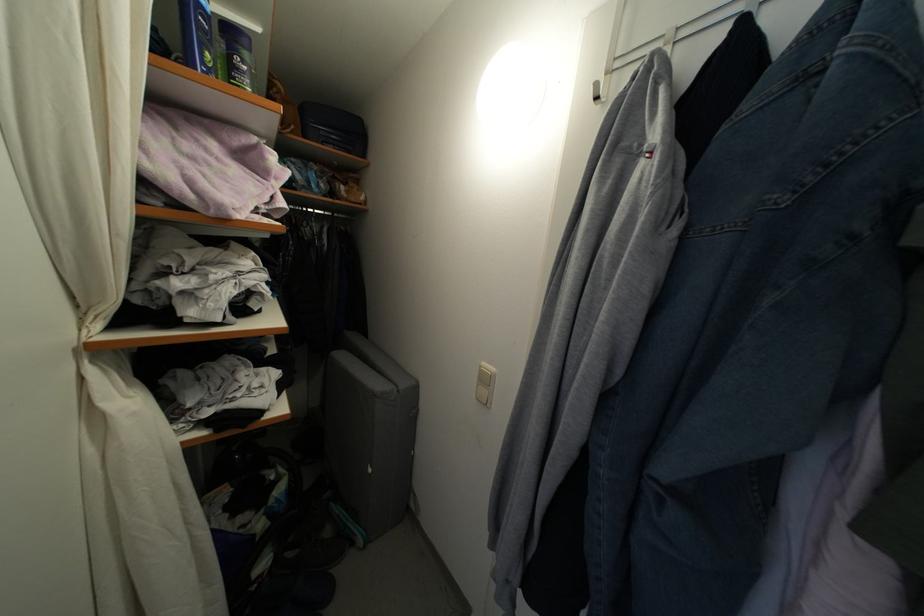
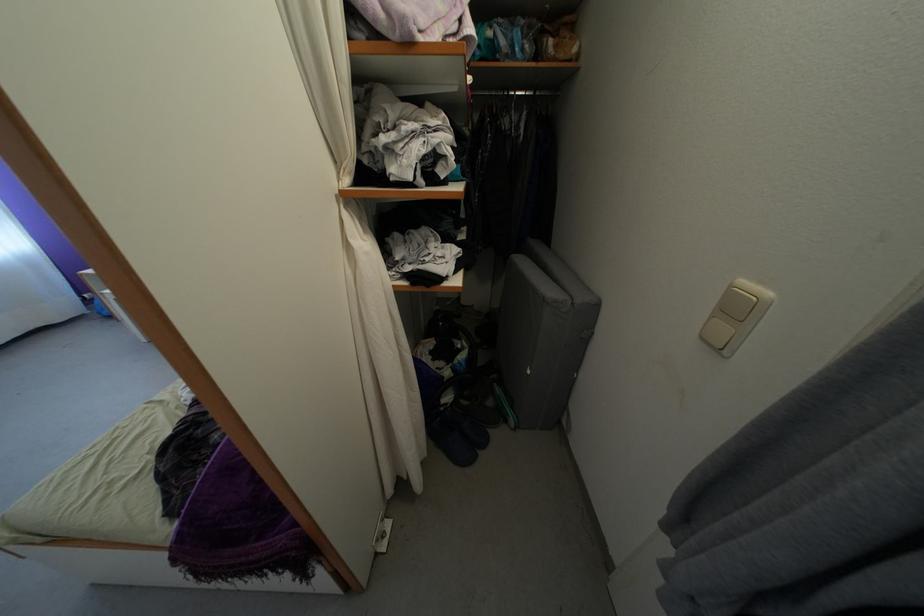
The point at (x=375, y=476) is marked in the first image. Where is the corresponding point in the second image?

(535, 378)